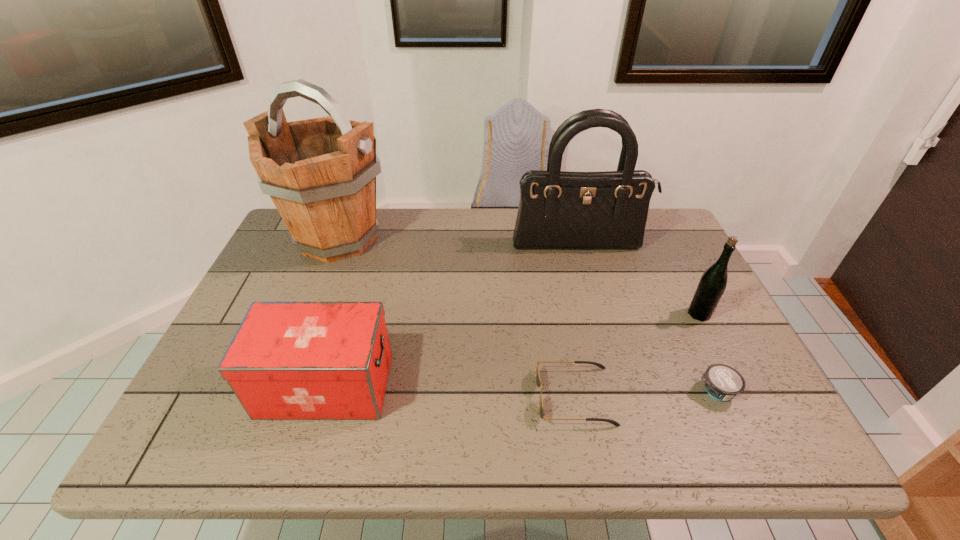
Image resolution: width=960 pixels, height=540 pixels. I want to click on vacant area that lies between the bucket and the sunglasses, so click(x=456, y=318).

You are a GUI agent. You are given a task and a screenshot of the screen. Output one action in this format:
    pyautogui.click(x=<x>, y=<y>)
    Task: Click on the vacant area that lies between the handbag and the fourth tallest object
    
    Given the screenshot: What is the action you would take?
    pyautogui.click(x=452, y=316)

Identify which object is located as the nearest to the bucket. Please provide its 2D coordinates. Your answer should be formatted as a tuple, i.e. [(x, y)], where the tuple contains the x and y coordinates of a point satisfying the conditions above.

[(288, 360)]

You are a GUI agent. You are given a task and a screenshot of the screen. Output one action in this format:
    pyautogui.click(x=<x>, y=<y>)
    Task: Click on the object that stands as the fourth closest to the bucket
    
    Given the screenshot: What is the action you would take?
    pyautogui.click(x=712, y=284)

Identify the location of vacant space that satisfies the following two spatial constraints: 1. on the handle side of the first-aid kit; 2. on the back side of the yogurt. The width and height of the screenshot is (960, 540). (324, 391).

The image size is (960, 540). In order to click on free location that satisfies the following two spatial constraints: 1. with an open clasp on the front of the handbag; 2. on the left side of the yogurt in this screenshot , I will do coord(618,391).

This screenshot has height=540, width=960. I want to click on vacant area in the image that satisfies the following two spatial constraints: 1. with an open clasp on the front of the yogurt; 2. on the right side of the handbag, so click(618, 391).

The height and width of the screenshot is (540, 960). Identify the location of blank area in the image that satisfies the following two spatial constraints: 1. on the handle side of the first-aid kit; 2. on the back side of the yogurt. (324, 391).

Locate an element on the screen. Image resolution: width=960 pixels, height=540 pixels. free space that satisfies the following two spatial constraints: 1. on the handle side of the third shortest object; 2. on the right side of the yogurt is located at coordinates (324, 391).